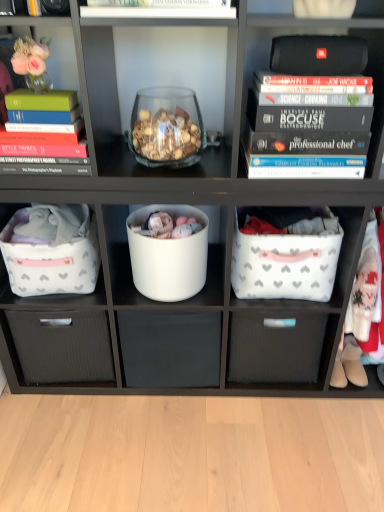
The width and height of the screenshot is (384, 512). What do you see at coordinates (170, 348) in the screenshot?
I see `white matte drawer at center, placed as the 2th drawer when sorted from right to left` at bounding box center [170, 348].

This screenshot has width=384, height=512. I want to click on white matte bucket at center, so click(168, 258).

This screenshot has height=512, width=384. Describe the element at coordinates (42, 127) in the screenshot. I see `matte green hardcover book at left` at that location.

What is the approximate width of matte green hardcover book at left?

matte green hardcover book at left is 9.62 inches in width.

You are a GUI agent. You are given a task and a screenshot of the screen. Output one action in this format:
    pyautogui.click(x=<x>, y=<y>)
    Task: Click on the translucent glass bowl at center
    Image resolution: width=384 pixels, height=512 pixels.
    Given the screenshot: What is the action you would take?
    pyautogui.click(x=166, y=135)

The image size is (384, 512). I want to click on white matte drawer at center, the first drawer when ordered from left to right, so click(x=170, y=348).

From the image's perspective, between white fabric drawer at center, the 1th drawer viewed from the right, and white fabric laundry basket at center right, which is the second laundry basket from left to right, which one is located above?

white fabric laundry basket at center right, which is the second laundry basket from left to right.

Considering the relative positions of white fabric drawer at center, the 1th drawer viewed from the right, and white fabric laundry basket at center right, the 1th laundry basket when ordered from right to left, in the image provided, is white fabric drawer at center, the 1th drawer viewed from the right, to the left of white fabric laundry basket at center right, the 1th laundry basket when ordered from right to left, from the viewer's perspective?

Yes.

Is white fabric drawer at center, the 1th drawer viewed from the right, positioned behind white fabric laundry basket at center right, which is the second laundry basket from left to right?

That is True.

From a real-world perspective, which object rests below the other?

white fabric drawer at center, the 1th drawer viewed from the right, from a real-world perspective.

Where is `book that appears on the left of white fabric laundry basket at center right, which is the second laundry basket from left to right`? The image size is (384, 512). book that appears on the left of white fabric laundry basket at center right, which is the second laundry basket from left to right is located at coordinates (42, 127).

Is white fabric laundry basket at center right, the 1th laundry basket when ordered from right to left, not close to matte green hardcover book at left?

No.

In the scene shown: Which object is positioned more to the left, white fabric laundry basket at center right, the 1th laundry basket when ordered from right to left, or matte green hardcover book at left?

matte green hardcover book at left.

Based on the photo, is white fabric laundry basket at center right, which is the second laundry basket from left to right, oriented towards matte green hardcover book at left?

No, white fabric laundry basket at center right, which is the second laundry basket from left to right, does not turn towards matte green hardcover book at left.

From the image's perspective, does white matte bucket at center appear lower than white matte drawer at center, placed as the 2th drawer when sorted from right to left?

No, from the image's perspective, white matte bucket at center is not beneath white matte drawer at center, placed as the 2th drawer when sorted from right to left.

Choose the correct answer: Is white matte bucket at center inside white matte drawer at center, placed as the 2th drawer when sorted from right to left, or outside it?

white matte bucket at center is spatially situated outside white matte drawer at center, placed as the 2th drawer when sorted from right to left.

Are white matte bucket at center and white matte drawer at center, the first drawer when ordered from left to right, located far from each other?

white matte bucket at center is near white matte drawer at center, the first drawer when ordered from left to right, not far away.

Which is in front, point (156, 208) or point (153, 312)?

Positioned in front is point (156, 208).

Considering the sizes of objects white fabric laundry basket at left, placed as the 1th laundry basket when sorted from left to right, and matte green hardcover book at left in the image provided, who is smaller, white fabric laundry basket at left, placed as the 1th laundry basket when sorted from left to right, or matte green hardcover book at left?

With smaller size is matte green hardcover book at left.

Where is `book positioned vertically above the white fabric laundry basket at left, placed as the 1th laundry basket when sorted from left to right (from a real-world perspective)`? The height and width of the screenshot is (512, 384). book positioned vertically above the white fabric laundry basket at left, placed as the 1th laundry basket when sorted from left to right (from a real-world perspective) is located at coordinates (42, 127).

From a real-world perspective, which object stands above the other?

matte green hardcover book at left is physically above.

Is white fabric laundry basket at left, the 2th laundry basket from the right, positioned with its back to matte green hardcover book at left?

No, white fabric laundry basket at left, the 2th laundry basket from the right, is not facing away from matte green hardcover book at left.

Does white fabric drawer at center, the 1th drawer viewed from the right, have a larger size compared to white matte bucket at center?

Indeed, white fabric drawer at center, the 1th drawer viewed from the right, has a larger size compared to white matte bucket at center.

Considering the sizes of white fabric drawer at center, arranged as the second drawer when viewed from the left, and white matte bucket at center in the image, is white fabric drawer at center, arranged as the second drawer when viewed from the left, taller or shorter than white matte bucket at center?

Clearly, white fabric drawer at center, arranged as the second drawer when viewed from the left, is taller compared to white matte bucket at center.

Is white fabric drawer at center, the 1th drawer viewed from the right, next to white matte bucket at center?

They are not placed beside each other.

Is black hardcover books at upper right far away from black matte speaker at upper right?

That's not correct — black hardcover books at upper right is a little close to black matte speaker at upper right.

Consider the image. Based on their sizes in the image, would you say black hardcover books at upper right is bigger or smaller than black matte speaker at upper right?

black hardcover books at upper right is bigger than black matte speaker at upper right.

Who is taller, black hardcover books at upper right or black matte speaker at upper right?

black hardcover books at upper right.

Is black hardcover books at upper right far from white fabric laundry basket at center right, which is the second laundry basket from left to right?

No.

How different are the orientations of black hardcover books at upper right and white fabric laundry basket at center right, the 1th laundry basket when ordered from right to left, in degrees?

0.158 degrees separate the facing orientations of black hardcover books at upper right and white fabric laundry basket at center right, the 1th laundry basket when ordered from right to left.

Considering the relative sizes of black hardcover books at upper right and white fabric laundry basket at center right, which is the second laundry basket from left to right, in the image provided, is black hardcover books at upper right wider than white fabric laundry basket at center right, which is the second laundry basket from left to right,?

No, black hardcover books at upper right is not wider than white fabric laundry basket at center right, which is the second laundry basket from left to right.

Is point (258, 28) farther from camera compared to point (280, 247)?

No, it is in front of (280, 247).

Image resolution: width=384 pixels, height=512 pixels. I want to click on the 2nd drawer behind the white fabric laundry basket at center right, the 1th laundry basket when ordered from right to left, counting from the anchor's position, so click(x=275, y=347).

Image resolution: width=384 pixels, height=512 pixels. I want to click on book on the left of white fabric laundry basket at center right, the 1th laundry basket when ordered from right to left, so click(x=42, y=127).

From the image, which object appears to be nearer to black hardcover books at upper right, white fabric laundry basket at left, the 2th laundry basket from the right, or white matte drawer at center, placed as the 2th drawer when sorted from right to left?

white fabric laundry basket at left, the 2th laundry basket from the right, is closer to black hardcover books at upper right.

Which object lies further to the anchor point black matte speaker at upper right, white matte bucket at center or white fabric drawer at center, arranged as the second drawer when viewed from the left?

Among the two, white fabric drawer at center, arranged as the second drawer when viewed from the left, is located further to black matte speaker at upper right.

Looking at the image, which one is located closer to white matte drawer at center, placed as the 2th drawer when sorted from right to left, white fabric laundry basket at left, the 2th laundry basket from the right, or matte green hardcover book at left?

The object closer to white matte drawer at center, placed as the 2th drawer when sorted from right to left, is white fabric laundry basket at left, the 2th laundry basket from the right.

Looking at the image, which one is located further to white fabric drawer at center, the 1th drawer viewed from the right, translucent glass bowl at center or matte green hardcover book at left?

matte green hardcover book at left.

From the picture: From the image, which object appears to be farther from matte green hardcover book at left, white fabric drawer at center, arranged as the second drawer when viewed from the left, or white fabric laundry basket at center right, the 1th laundry basket when ordered from right to left?

Among the two, white fabric drawer at center, arranged as the second drawer when viewed from the left, is located further to matte green hardcover book at left.

Which object lies nearer to the anchor point translucent glass bowl at center, white fabric laundry basket at left, placed as the 1th laundry basket when sorted from left to right, or white fabric laundry basket at center right, the 1th laundry basket when ordered from right to left?

white fabric laundry basket at left, placed as the 1th laundry basket when sorted from left to right.

When comparing their distances from white fabric laundry basket at left, placed as the 1th laundry basket when sorted from left to right, does black hardcover books at upper right or white fabric drawer at center, arranged as the second drawer when viewed from the left, seem further?

black hardcover books at upper right lies further to white fabric laundry basket at left, placed as the 1th laundry basket when sorted from left to right, than the other object.

Based on their spatial positions, is white matte bucket at center or white matte drawer at center, placed as the 2th drawer when sorted from right to left, closer to white fabric drawer at center, arranged as the second drawer when viewed from the left?

white matte drawer at center, placed as the 2th drawer when sorted from right to left, lies closer to white fabric drawer at center, arranged as the second drawer when viewed from the left, than the other object.

Image resolution: width=384 pixels, height=512 pixels. Identify the location of drawer between black matte speaker at upper right and white fabric drawer at center, the 1th drawer viewed from the right, in the vertical direction. (170, 348).

The height and width of the screenshot is (512, 384). Identify the location of book that lies between translucent glass bowl at center and white matte bucket at center from top to bottom. (42, 127).

The image size is (384, 512). Find the location of `stuff between black matte speaker at upper right and white fabric laundry basket at center right, which is the second laundry basket from left to right, in the up-down direction`. stuff between black matte speaker at upper right and white fabric laundry basket at center right, which is the second laundry basket from left to right, in the up-down direction is located at coordinates (166, 135).

Find the location of a particular element. The width and height of the screenshot is (384, 512). storage box between matte green hardcover book at left and white matte drawer at center, the first drawer when ordered from left to right, from top to bottom is located at coordinates (168, 258).